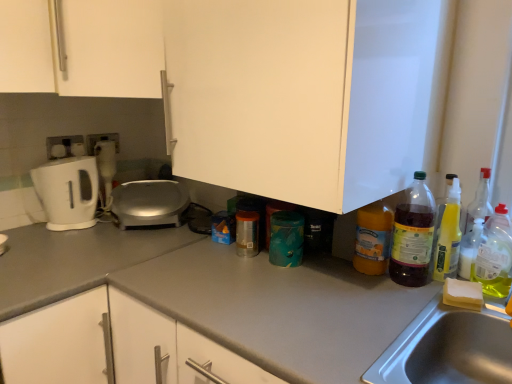
The image size is (512, 384). Identify the location of vacant space in front of white plastic coffee machine at left. (91, 223).